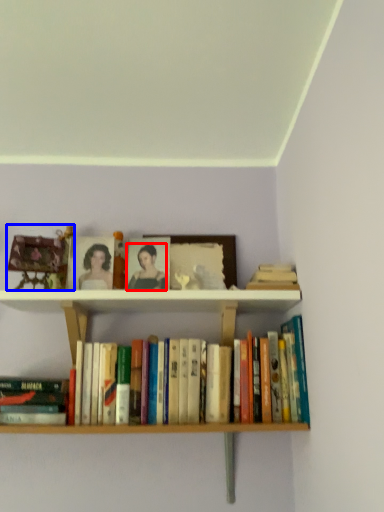
Question: Which object is further to the camera taking this photo, person (highlighted by a red box) or toy (highlighted by a blue box)?

Choices:
 (A) person
 (B) toy

Answer: (A)